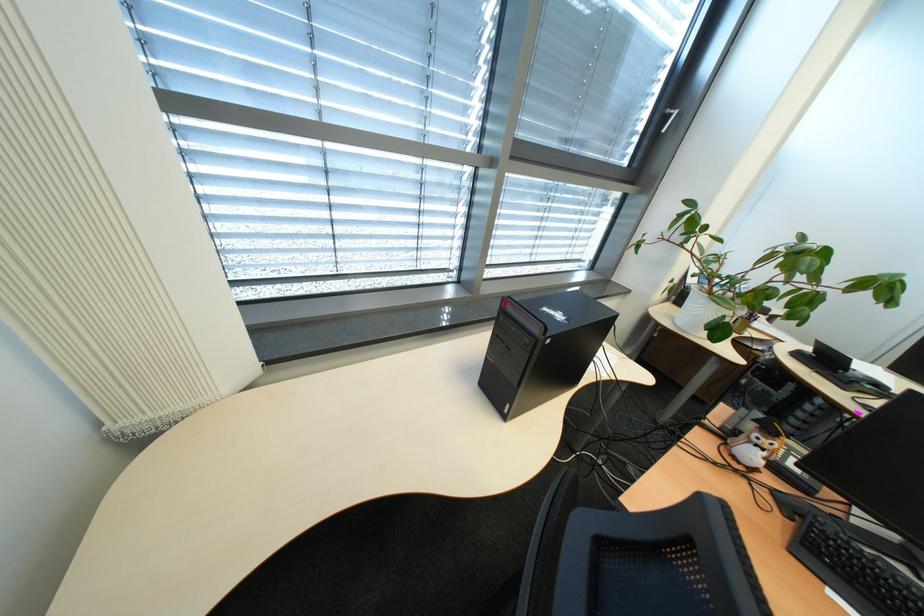
Where is `computer power button`? computer power button is located at coordinates (517, 369).